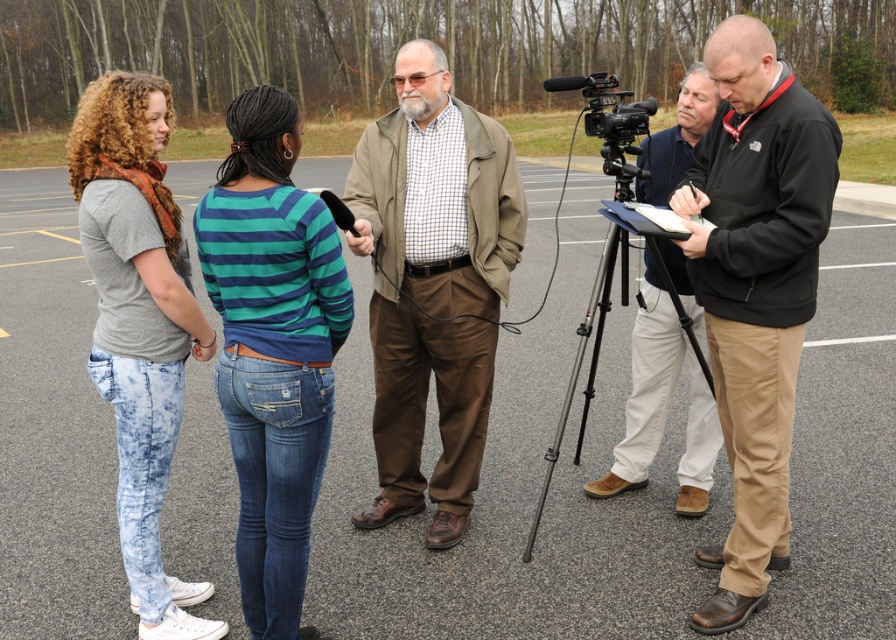
Question: Among these objects, which one is farthest from the camera?

Choices:
 (A) black plastic video camera at right
 (B) blue-green striped shirt at center
 (C) light blue faded jeans at left

Answer: (A)

Question: Is light blue faded jeans at left above black metal tripod at lower right?

Choices:
 (A) yes
 (B) no

Answer: (A)

Question: Is black softshell jacket at right above light blue faded jeans at left?

Choices:
 (A) no
 (B) yes

Answer: (B)

Question: Which of these objects is positioned farthest from the black plastic video camera at right?

Choices:
 (A) black softshell jacket at right
 (B) blue-green striped shirt at center
 (C) brown cotton pants at center
 (D) black metal tripod at lower right

Answer: (B)

Question: Can you confirm if black softshell jacket at right is wider than blue-green striped shirt at center?

Choices:
 (A) yes
 (B) no

Answer: (A)

Question: Which point is closer to the camera?

Choices:
 (A) (788, 211)
 (B) (487, 129)
 (C) (152, 413)

Answer: (A)